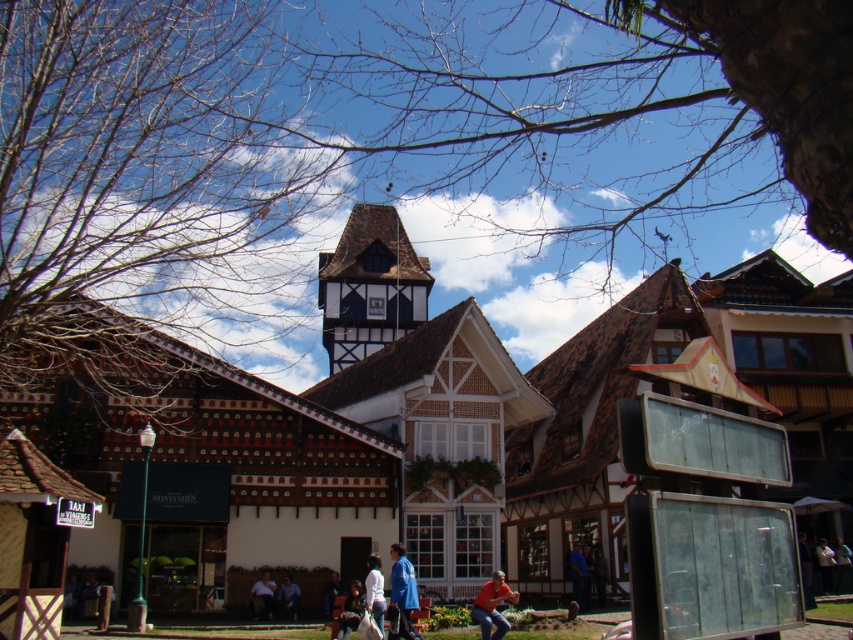
Question: Does blue fabric shirt at lower center come in front of light brown leather jacket at lower center?

Choices:
 (A) no
 (B) yes

Answer: (A)

Question: Does wooden building at center appear on the left side of blue fabric jacket at lower center?

Choices:
 (A) no
 (B) yes

Answer: (A)

Question: Which object is positioned farthest from the matte red shirt at lower center?

Choices:
 (A) blue fabric shirt at lower center
 (B) light brown leather jacket at lower center

Answer: (B)

Question: In this image, where is matte red shirt at lower center located relative to blue denim jeans at lower center?

Choices:
 (A) above
 (B) below

Answer: (B)

Question: Which object is farther from the camera taking this photo?

Choices:
 (A) white matte jacket at lower center
 (B) wooden building at center

Answer: (A)

Question: Which point is farther to the camera?

Choices:
 (A) white cotton shirt at lower center
 (B) blue denim jeans at lower center

Answer: (B)